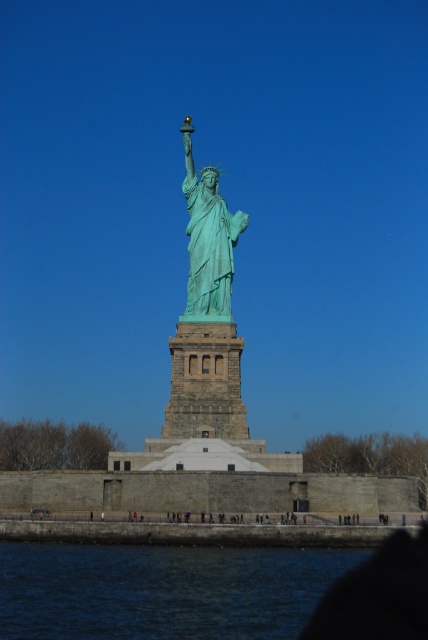
Question: Does blue liquid water at lower left come in front of green patina statue at center?

Choices:
 (A) no
 (B) yes

Answer: (B)

Question: Does blue liquid water at lower left have a smaller size compared to green patina statue at center?

Choices:
 (A) yes
 (B) no

Answer: (A)

Question: Can you confirm if blue liquid water at lower left is bigger than green patina statue at center?

Choices:
 (A) no
 (B) yes

Answer: (A)

Question: Among these objects, which one is nearest to the camera?

Choices:
 (A) green patina statue at center
 (B) blue liquid water at lower left

Answer: (B)

Question: Among these objects, which one is nearest to the camera?

Choices:
 (A) green patina statue at center
 (B) blue liquid water at lower left

Answer: (B)